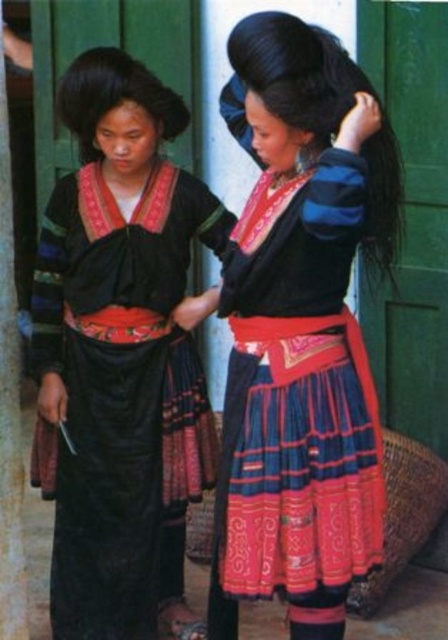
Question: Is matte black blouse at upper center above matte black skirt at left?

Choices:
 (A) yes
 (B) no

Answer: (A)

Question: Can you confirm if matte black skirt at left is bigger than wooden pole at left?

Choices:
 (A) yes
 (B) no

Answer: (A)

Question: Considering the real-world distances, which object is closest to the wooden pole at left?

Choices:
 (A) matte black blouse at upper center
 (B) matte black skirt at left

Answer: (B)

Question: Which of the following is the closest to the observer?

Choices:
 (A) pos(102,614)
 (B) pos(327,605)

Answer: (B)

Question: Does matte black blouse at upper center appear on the right side of matte black skirt at left?

Choices:
 (A) yes
 (B) no

Answer: (A)

Question: Considering the real-world distances, which object is farthest from the wooden pole at left?

Choices:
 (A) matte black blouse at upper center
 (B) matte black skirt at left

Answer: (A)